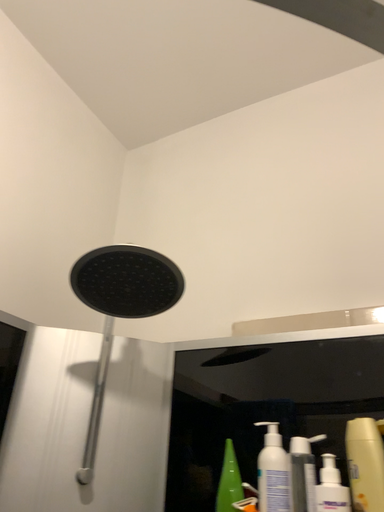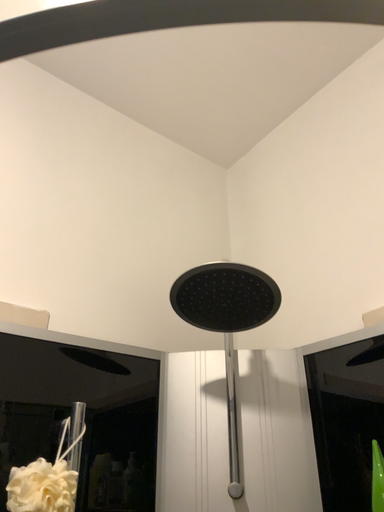
Question: How did the camera likely rotate when shooting the video?

Choices:
 (A) rotated right
 (B) rotated left

Answer: (B)